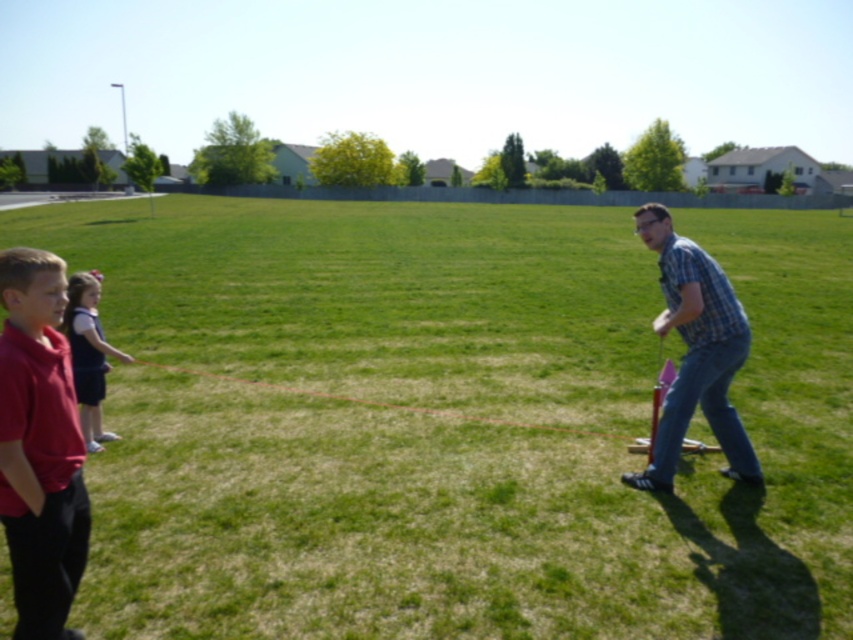
You are a photographer trying to capture a photo of the plaid shirt at right and the dark blue dress at left. Since you want both subjects to be in focus, you need to know their relative positions. Which subject is closer to the camera?

The plaid shirt at right is in front of the dark blue dress at left, so the plaid shirt at right is closer to the camera.

You are planning to place a small picnic blanket on the green grassy field at center and the red string at center. Which area should you choose to ensure the blanket is closer to the left side of the scene?

The green grassy field at center is positioned on the left side of red string at center, so placing the picnic blanket there will be closer to the left side of the scene.

You are a photographer trying to capture a group photo of the matte red shirt at left and the plaid shirt at right. If you want to ensure both subjects are in focus, which one should you focus on first, the taller or shorter person?

The matte red shirt at left is shorter than the plaid shirt at right. To ensure both are in focus, focus on the taller person first, which is the plaid shirt at right, as they are further away.